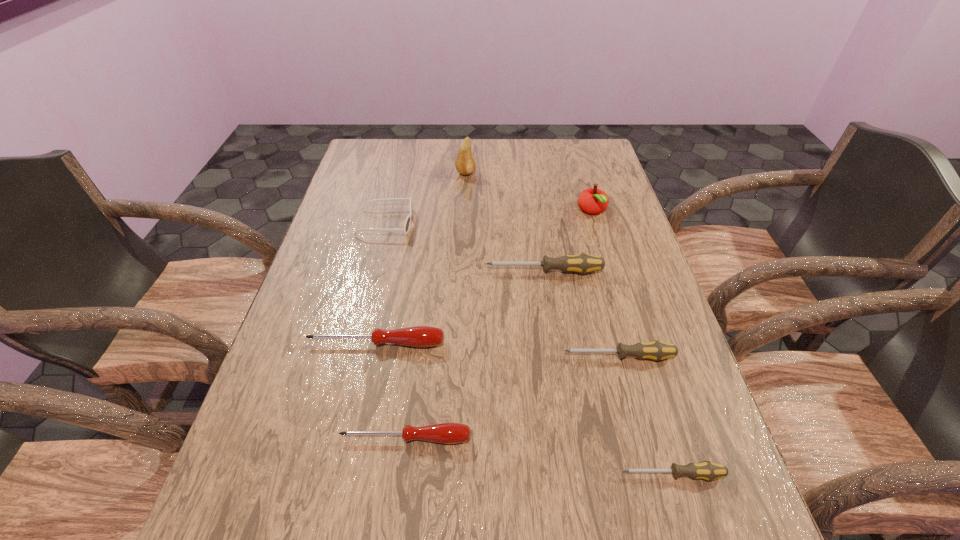
The height and width of the screenshot is (540, 960). I want to click on the second nearest object, so click(x=446, y=433).

This screenshot has width=960, height=540. What are the coordinates of `the nearest object` in the screenshot? It's located at (706, 470).

At what (x,y) coordinates should I click in order to perform the action: click on the nearest gray screwdriver. Please return your answer as a coordinate pair (x, y). Looking at the image, I should click on (706, 470).

Locate an element on the screen. The image size is (960, 540). vacant space situated on the right of the farthest object is located at coordinates (506, 173).

I want to click on vacant space located on the back of the red apple, so click(583, 179).

Identify the location of vacant area located at the tip of the farthest gray screwdriver. (352, 271).

This screenshot has height=540, width=960. Identify the location of vacant point located 0.120m at the tip of the farthest gray screwdriver. (439, 271).

You are a GUI agent. You are given a task and a screenshot of the screen. Output one action in this format:
    pyautogui.click(x=<x>, y=<y>)
    Task: Click on the vacant position located at the tip of the farthest gray screwdriver
    The image size is (960, 540).
    Given the screenshot: What is the action you would take?
    pyautogui.click(x=360, y=271)

The height and width of the screenshot is (540, 960). Find the location of `free space located with the lenses of the black sunglasses facing outward`. free space located with the lenses of the black sunglasses facing outward is located at coordinates (434, 223).

Where is `vacant space situated 0.070m on the back of the bigger red screwdriver`? Image resolution: width=960 pixels, height=540 pixels. vacant space situated 0.070m on the back of the bigger red screwdriver is located at coordinates (383, 311).